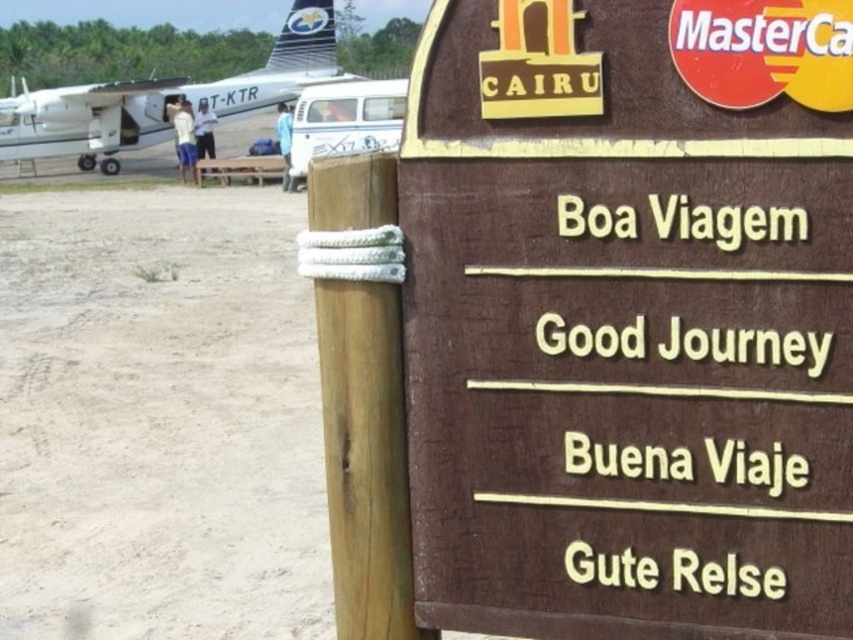
Question: Is brown wooden sign at center above light brown sand at lower left?

Choices:
 (A) yes
 (B) no

Answer: (B)

Question: Is brown wooden sign at center positioned before light brown sand at lower left?

Choices:
 (A) yes
 (B) no

Answer: (A)

Question: Where is light brown sand at lower left located in relation to white glossy airplane at upper left in the image?

Choices:
 (A) right
 (B) left

Answer: (A)

Question: Which of the following is the closest to the observer?

Choices:
 (A) light brown sand at lower left
 (B) brown wooden sign at center
 (C) white glossy airplane at upper left

Answer: (B)

Question: Which point appears closest to the camera in this image?

Choices:
 (A) (711, 560)
 (B) (316, 424)
 (C) (44, 131)

Answer: (A)

Question: Which point is farther to the camera?

Choices:
 (A) (234, 456)
 (B) (103, 160)

Answer: (B)